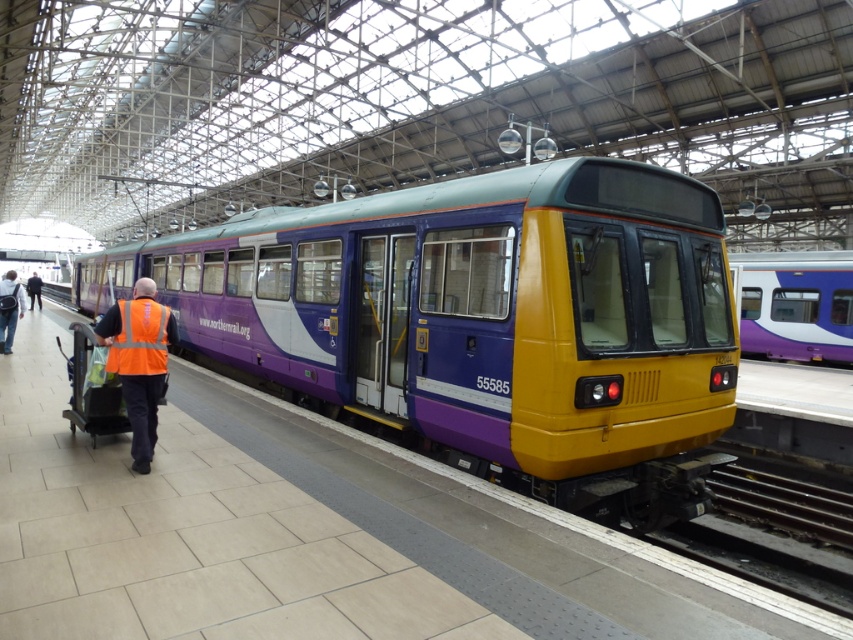
Who is positioned more to the right, purple glossy train at center or metallic steel train track at lower right?

metallic steel train track at lower right is more to the right.

Does purple glossy train at center come behind metallic steel train track at lower right?

No, purple glossy train at center is in front of metallic steel train track at lower right.

Describe the element at coordinates (483, 321) in the screenshot. I see `purple glossy train at center` at that location.

Locate an element on the screen. The height and width of the screenshot is (640, 853). purple glossy train at center is located at coordinates (483, 321).

Is the position of matte purple train at right more distant than that of orange reflective vest at left?

No, it is not.

Describe the element at coordinates (793, 304) in the screenshot. Image resolution: width=853 pixels, height=640 pixels. I see `matte purple train at right` at that location.

Which is in front, point (750, 264) or point (33, 275)?

Positioned in front is point (750, 264).

The image size is (853, 640). What are the coordinates of `matte purple train at right` in the screenshot? It's located at (793, 304).

Can you confirm if purple glossy train at center is smaller than matte purple train at right?

No.

Who is lower down, purple glossy train at center or matte purple train at right?

matte purple train at right is lower down.

Who is more distant from viewer, (x=228, y=301) or (x=810, y=266)?

Point (x=810, y=266)

Image resolution: width=853 pixels, height=640 pixels. I want to click on purple glossy train at center, so click(x=483, y=321).